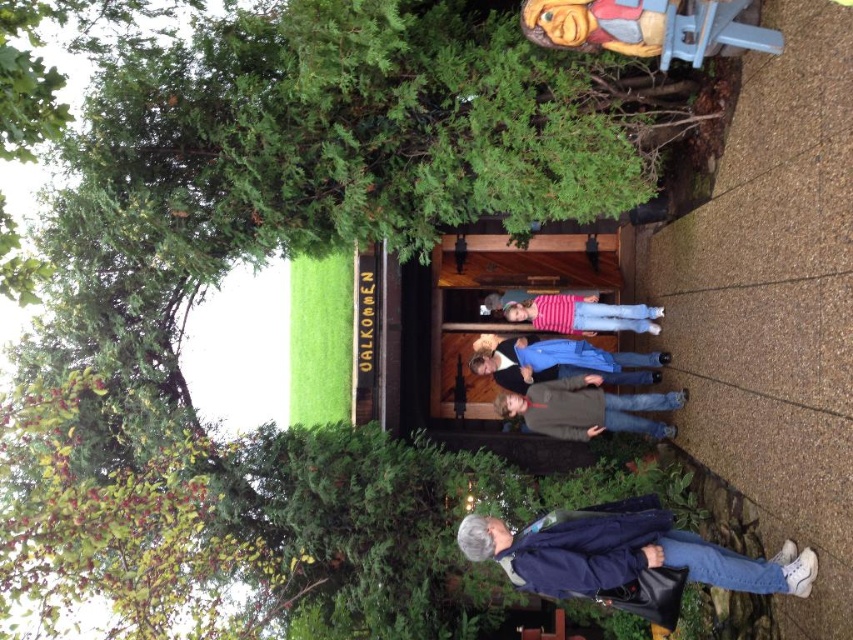
Can you confirm if dark blue jacket at lower right is bigger than dark gray sweater at center?

Indeed, dark blue jacket at lower right has a larger size compared to dark gray sweater at center.

Who is shorter, dark blue jacket at lower right or dark gray sweater at center?

dark blue jacket at lower right is shorter.

Who is more forward, (569, 548) or (665, 410)?

Point (569, 548)

Find the location of a particular element. The height and width of the screenshot is (640, 853). dark blue jacket at lower right is located at coordinates (625, 554).

Describe the element at coordinates (625, 554) in the screenshot. This screenshot has height=640, width=853. I see `dark blue jacket at lower right` at that location.

Can you confirm if dark blue jacket at lower right is thinner than blue denim jacket at center?

Incorrect, dark blue jacket at lower right's width is not less than blue denim jacket at center's.

Between point (665, 541) and point (495, 365), which one is positioned in front?

Positioned in front is point (665, 541).

Identify the location of dark blue jacket at lower right. This screenshot has height=640, width=853. (625, 554).

Between point (628, 380) and point (558, 330), which one is positioned in front?

Point (628, 380)

Which is above, blue denim jacket at center or striped cotton shirt at center?

Positioned higher is striped cotton shirt at center.

Who is more distant from viewer, (631, 371) or (540, 296)?

Point (631, 371)

The image size is (853, 640). Identify the location of blue denim jacket at center. [560, 362].